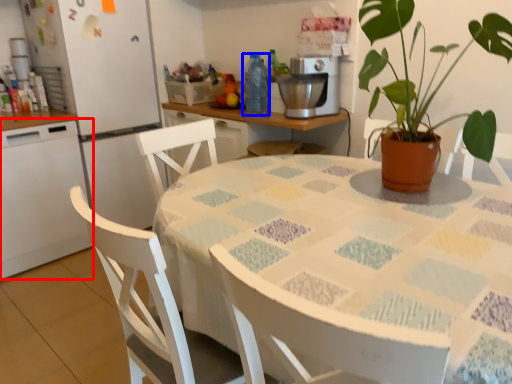
Question: Which of the following is the farthest to the observer, kitchen appliance (highlighted by a red box) or bottle (highlighted by a blue box)?

Choices:
 (A) kitchen appliance
 (B) bottle

Answer: (B)